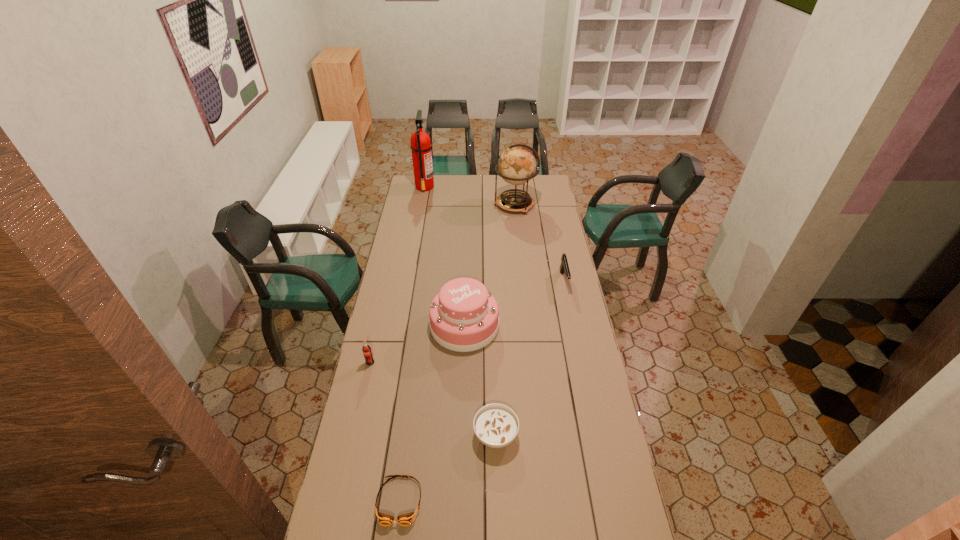
The height and width of the screenshot is (540, 960). I want to click on the closest object to the fire extinguisher, so click(x=517, y=165).

Identify which object is the sixth closest to the fourth farthest object. Please provide its 2D coordinates. Your answer should be formatted as a tuple, i.e. [(x, y)], where the tuple contains the x and y coordinates of a point satisfying the conditions above.

[(420, 146)]

You are a GUI agent. You are given a task and a screenshot of the screen. Output one action in this format:
    pyautogui.click(x=<x>, y=<y>)
    Task: Click on the vacant space that satisfies the following two spatial constraints: 1. on the label of the leftmost object; 2. on the left side of the soup bowl
    
    Given the screenshot: What is the action you would take?
    pyautogui.click(x=354, y=435)

What are the coordinates of `blank area in the image that satisfies the following two spatial constraints: 1. at the center of the globe; 2. with the lenses facing forward on the goggles` in the screenshot? It's located at (545, 501).

Where is `free space in the image that satisfies the following two spatial constraints: 1. on the side of the fifth shortest object near the handle; 2. on the right side of the fire extinguisher`? free space in the image that satisfies the following two spatial constraints: 1. on the side of the fifth shortest object near the handle; 2. on the right side of the fire extinguisher is located at coordinates (400, 325).

Where is `vacant region that satisfies the following two spatial constraints: 1. at the center of the globe; 2. with the lenses facing forward on the goggles`? This screenshot has height=540, width=960. vacant region that satisfies the following two spatial constraints: 1. at the center of the globe; 2. with the lenses facing forward on the goggles is located at coordinates (545, 501).